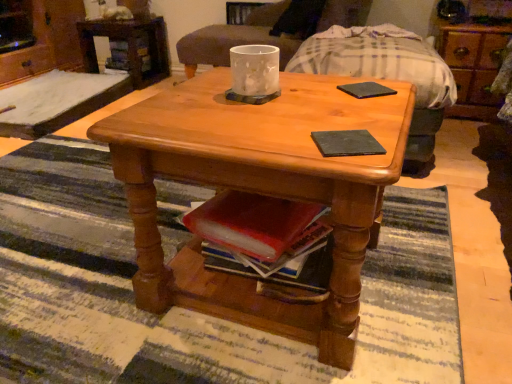
Where is `vacant area that lies between black matte pad at center, which is the second pad from front to back, and black matte pad at center, the 2th pad positioned from the back`? This screenshot has width=512, height=384. vacant area that lies between black matte pad at center, which is the second pad from front to back, and black matte pad at center, the 2th pad positioned from the back is located at coordinates (360, 113).